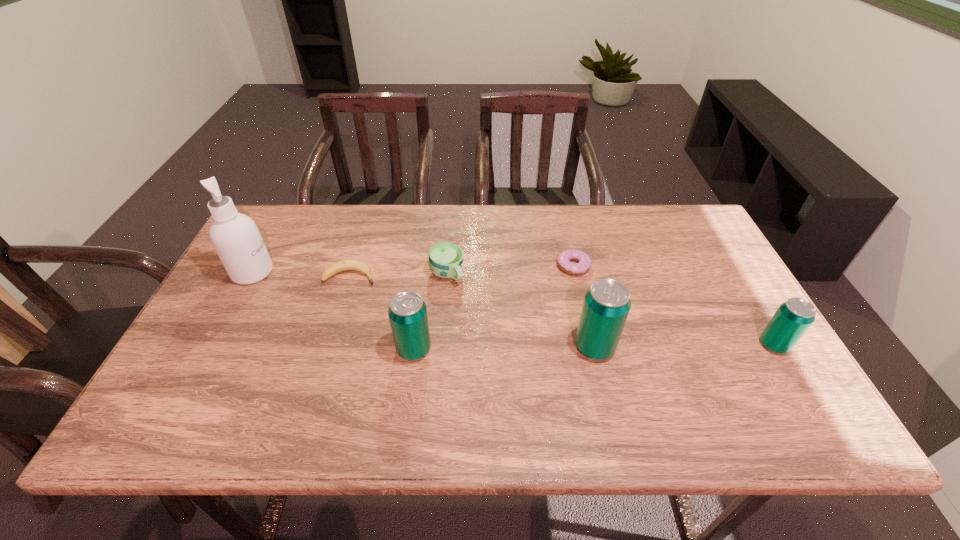
What are the coordinates of `vacant region at the near edge of the desktop` in the screenshot? It's located at (279, 398).

At what (x,y) coordinates should I click in order to perform the action: click on vacant area at the right edge of the desktop. Please return your answer as a coordinate pair (x, y). Looking at the image, I should click on (733, 294).

Find the location of a particular element. free space at the far right corner of the desktop is located at coordinates (690, 250).

What are the coordinates of `free space at the near right corner` in the screenshot? It's located at (746, 385).

The height and width of the screenshot is (540, 960). Find the location of `free area in between the second beer can from right to left and the third shortest object`. free area in between the second beer can from right to left and the third shortest object is located at coordinates (520, 310).

This screenshot has height=540, width=960. I want to click on vacant point located between the banana and the third shortest object, so click(x=398, y=275).

The image size is (960, 540). Identify the location of free space between the third shortest object and the fifth shortest object. (430, 312).

This screenshot has height=540, width=960. What are the coordinates of `empty space between the fifth shortest object and the banana` in the screenshot? It's located at (382, 312).

Identify the location of vacant area between the second beer can from left to right and the banana. (472, 311).

At what (x,y) coordinates should I click in order to perform the action: click on unoccupied area between the leftmost object and the cup. Please return your answer as a coordinate pair (x, y). Looking at the image, I should click on (349, 273).